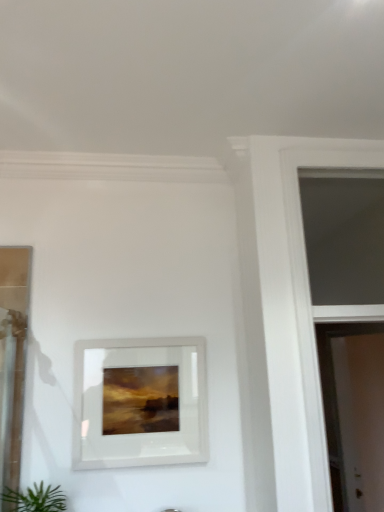
Question: Would you say green leafy plant at lower left contains white glossy picture frame at center?

Choices:
 (A) yes
 (B) no

Answer: (B)

Question: Considering the relative positions of green leafy plant at lower left and white glossy picture frame at center in the image provided, is green leafy plant at lower left in front of white glossy picture frame at center?

Choices:
 (A) no
 (B) yes

Answer: (B)

Question: From a real-world perspective, is green leafy plant at lower left on top of white glossy picture frame at center?

Choices:
 (A) yes
 (B) no

Answer: (B)

Question: From a real-world perspective, is green leafy plant at lower left physically below white glossy picture frame at center?

Choices:
 (A) no
 (B) yes

Answer: (B)

Question: Is green leafy plant at lower left to the right of white glossy picture frame at center from the viewer's perspective?

Choices:
 (A) no
 (B) yes

Answer: (A)

Question: From their relative heights in the image, would you say white glossy picture frame at center is taller or shorter than green leafy plant at lower left?

Choices:
 (A) tall
 (B) short

Answer: (A)

Question: Based on their positions, is white glossy picture frame at center located to the left or right of green leafy plant at lower left?

Choices:
 (A) right
 (B) left

Answer: (A)

Question: In terms of size, does white glossy picture frame at center appear bigger or smaller than green leafy plant at lower left?

Choices:
 (A) big
 (B) small

Answer: (B)

Question: From a real-world perspective, is white glossy picture frame at center positioned above or below green leafy plant at lower left?

Choices:
 (A) below
 (B) above

Answer: (B)

Question: Which is correct: transparent glass window at upper right is inside white glossy screen door at right, or outside of it?

Choices:
 (A) outside
 (B) inside

Answer: (A)

Question: From the image's perspective, is transparent glass window at upper right located above or below white glossy screen door at right?

Choices:
 (A) below
 (B) above

Answer: (B)

Question: Is transparent glass window at upper right to the left or to the right of white glossy screen door at right in the image?

Choices:
 (A) right
 (B) left

Answer: (B)

Question: In terms of height, does transparent glass window at upper right look taller or shorter compared to white glossy screen door at right?

Choices:
 (A) short
 (B) tall

Answer: (A)

Question: Visually, is white glossy picture frame at center positioned to the left or to the right of transparent glass window at upper right?

Choices:
 (A) right
 (B) left

Answer: (B)

Question: Looking at their shapes, would you say white glossy picture frame at center is wider or thinner than transparent glass window at upper right?

Choices:
 (A) wide
 (B) thin

Answer: (B)